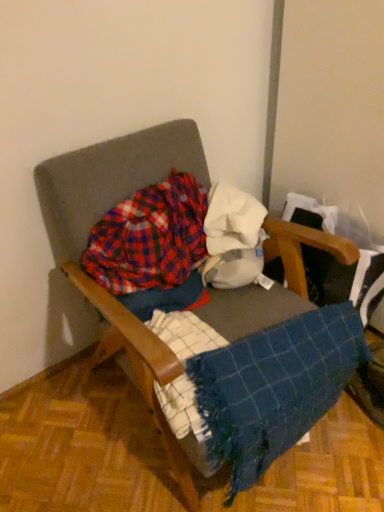
Question: Is plaid fabric at center not within blue woven blanket at lower right?

Choices:
 (A) yes
 (B) no

Answer: (A)

Question: Considering the relative sizes of plaid fabric at center and blue woven blanket at lower right in the image provided, is plaid fabric at center bigger than blue woven blanket at lower right?

Choices:
 (A) yes
 (B) no

Answer: (B)

Question: Can you confirm if plaid fabric at center is shorter than blue woven blanket at lower right?

Choices:
 (A) no
 (B) yes

Answer: (B)

Question: Is plaid fabric at center placed right next to blue woven blanket at lower right?

Choices:
 (A) yes
 (B) no

Answer: (B)

Question: Is plaid fabric at center at the right side of blue woven blanket at lower right?

Choices:
 (A) yes
 (B) no

Answer: (B)

Question: Is there a large distance between plaid fabric at center and blue woven blanket at lower right?

Choices:
 (A) no
 (B) yes

Answer: (A)

Question: Is blue woven blanket at lower right thinner than plaid fabric at center?

Choices:
 (A) no
 (B) yes

Answer: (A)

Question: Considering the relative sizes of blue woven blanket at lower right and plaid fabric at center in the image provided, is blue woven blanket at lower right bigger than plaid fabric at center?

Choices:
 (A) no
 (B) yes

Answer: (B)

Question: From the image's perspective, is blue woven blanket at lower right under plaid fabric at center?

Choices:
 (A) yes
 (B) no

Answer: (A)

Question: Is blue woven blanket at lower right behind plaid fabric at center?

Choices:
 (A) yes
 (B) no

Answer: (B)

Question: Is blue woven blanket at lower right facing away from plaid fabric at center?

Choices:
 (A) yes
 (B) no

Answer: (A)

Question: Can you confirm if blue woven blanket at lower right is wider than plaid fabric at center?

Choices:
 (A) yes
 (B) no

Answer: (A)

Question: Are wooden armchair at center and plaid fabric at center located far from each other?

Choices:
 (A) no
 (B) yes

Answer: (A)